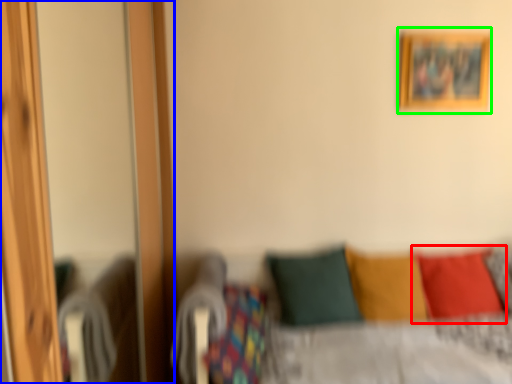
Question: Considering the real-world distances, which object is farthest from pillow (highlighted by a red box)? screen door (highlighted by a blue box) or picture frame (highlighted by a green box)?

Choices:
 (A) screen door
 (B) picture frame

Answer: (A)